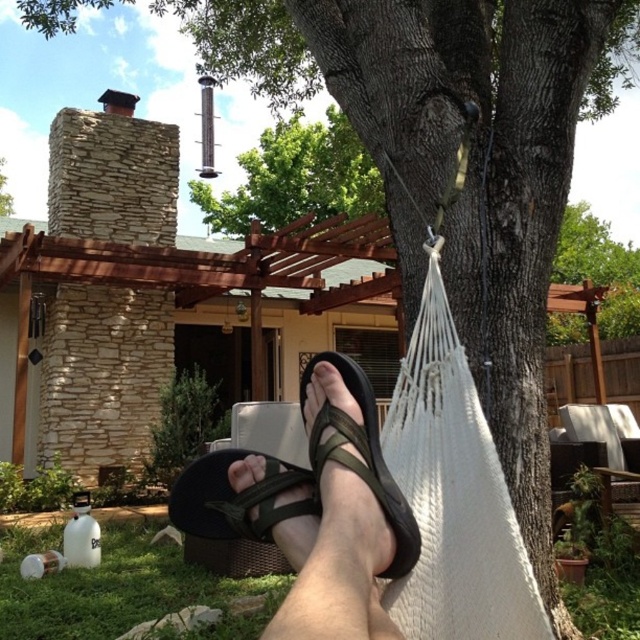
What do you see at coordinates (600, 268) in the screenshot? The height and width of the screenshot is (640, 640). I see `brown textured wood at upper center` at bounding box center [600, 268].

Measure the distance between brown textured wood at upper center and camera.

brown textured wood at upper center and camera are 7.78 feet apart.

Locate an element on the screen. The height and width of the screenshot is (640, 640). brown textured wood at upper center is located at coordinates (x=600, y=268).

Which of these two, green fabric sandals at center or green fabric sandal at lower center, stands shorter?

green fabric sandals at center is shorter.

Who is more forward, (266,493) or (269,563)?

Point (266,493)

You are a GUI agent. You are given a task and a screenshot of the screen. Output one action in this format:
    pyautogui.click(x=<x>, y=<y>)
    Task: Click on the green fabric sandals at center
    The image size is (640, 640).
    Given the screenshot: What is the action you would take?
    pyautogui.click(x=298, y=480)

Describe the element at coordinates (600, 268) in the screenshot. The width and height of the screenshot is (640, 640). I see `brown textured wood at upper center` at that location.

Is brown textured wood at upper center thinner than green rough stone chimney at upper left?

Incorrect, brown textured wood at upper center's width is not less than green rough stone chimney at upper left's.

Identify the location of brown textured wood at upper center. This screenshot has width=640, height=640. (600, 268).